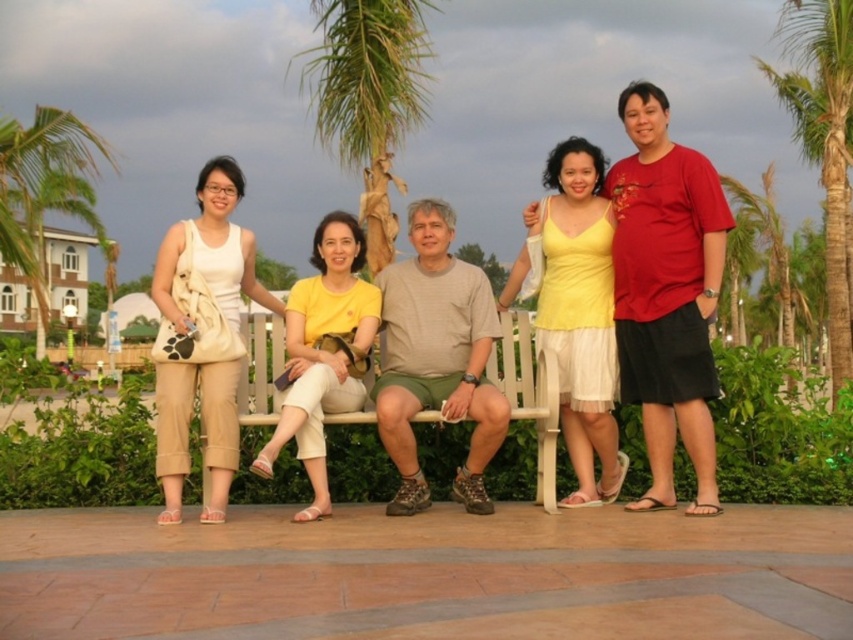
What object is located at the coordinate point (640, 221) in the image?

The point (640, 221) is on the beige fabric purse at upper left.